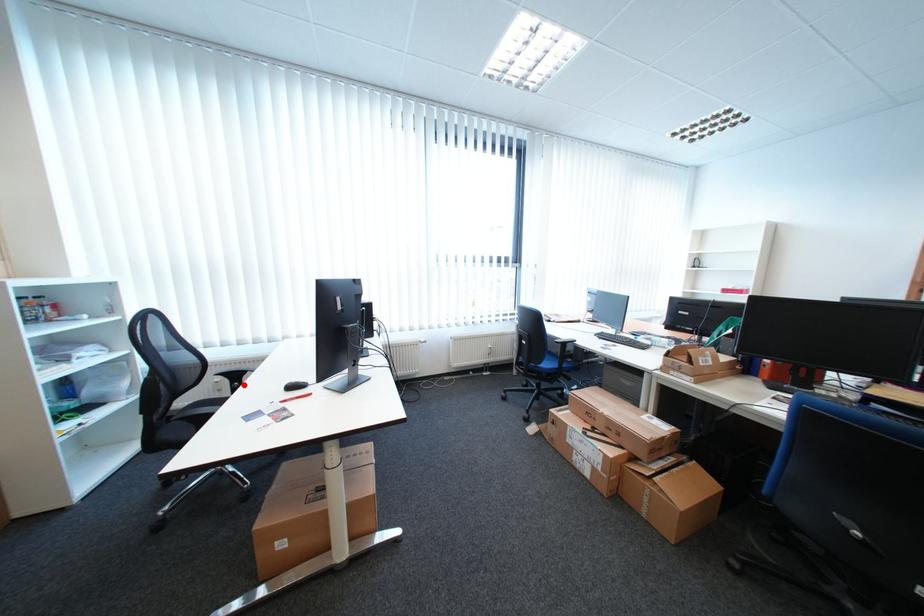
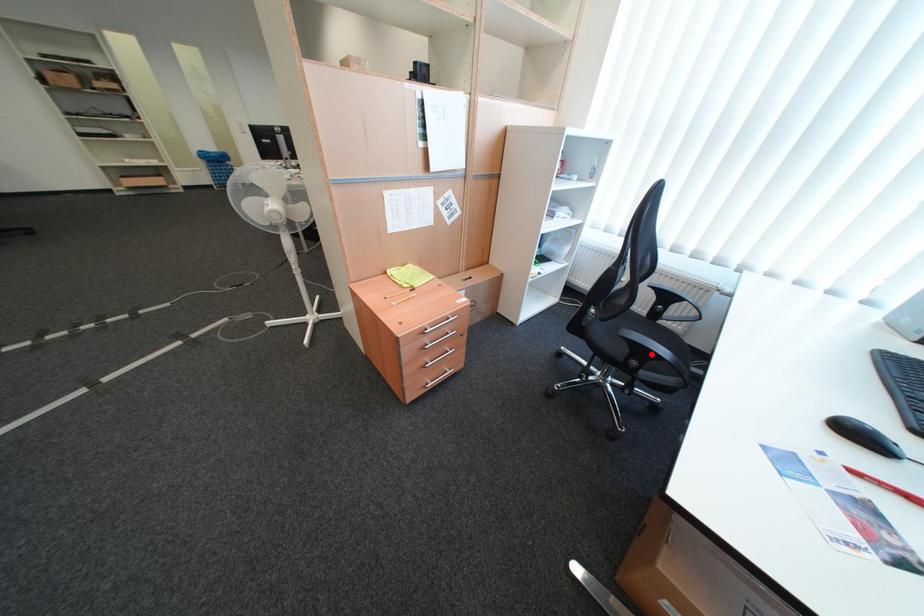
I am providing you with two images of the same scene from different viewpoints. A red point is marked on the first image and another point is marked on the second image. Is the marked point in image1 the same physical position as the marked point in image2?

No